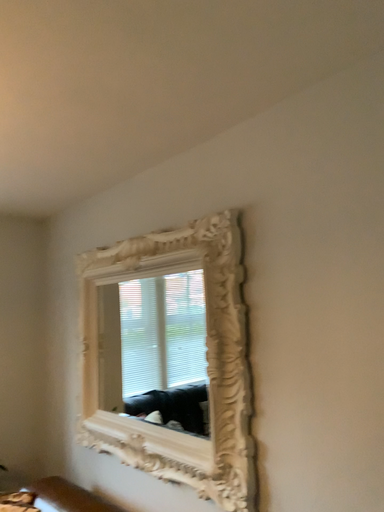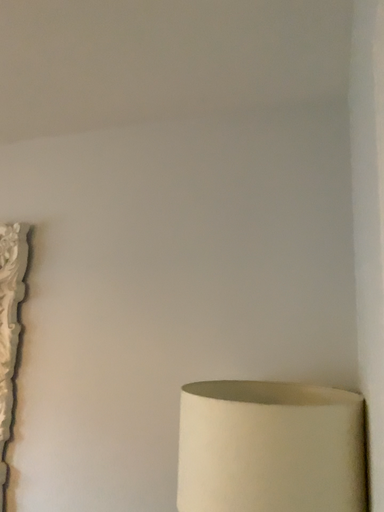
Question: How did the camera likely rotate when shooting the video?

Choices:
 (A) rotated right
 (B) rotated left

Answer: (A)